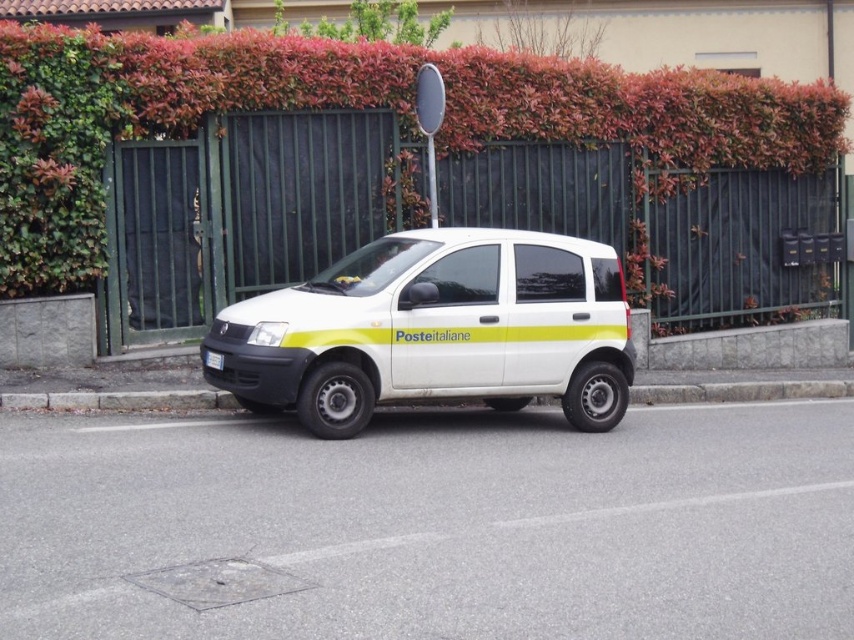
Which is below, gray concrete curb at lower center or white plastic license plate at center?

gray concrete curb at lower center

Between point (651, 394) and point (208, 360), which one is positioned behind?

The point (651, 394) is behind.

Locate an element on the screen. Image resolution: width=854 pixels, height=640 pixels. gray concrete curb at lower center is located at coordinates (120, 401).

Between white matte van at center and gray concrete curb at lower center, which one is positioned higher?

white matte van at center is higher up.

Is point (554, 392) behind point (729, 387)?

No, (554, 392) is closer to viewer.

At what (x,y) coordinates should I click in order to perform the action: click on white matte van at center. Please return your answer as a coordinate pair (x, y). This screenshot has width=854, height=640. Looking at the image, I should click on (436, 330).

The image size is (854, 640). What are the coordinates of `white matte van at center` in the screenshot? It's located at (436, 330).

Between point (66, 291) and point (720, 394), which one is positioned in front?

Positioned in front is point (66, 291).

Can you confirm if green leafy hedge at upper center is bigger than gray concrete curb at lower center?

Correct, green leafy hedge at upper center is larger in size than gray concrete curb at lower center.

Identify the location of green leafy hedge at upper center. (352, 109).

Identify the location of green leafy hedge at upper center. (352, 109).